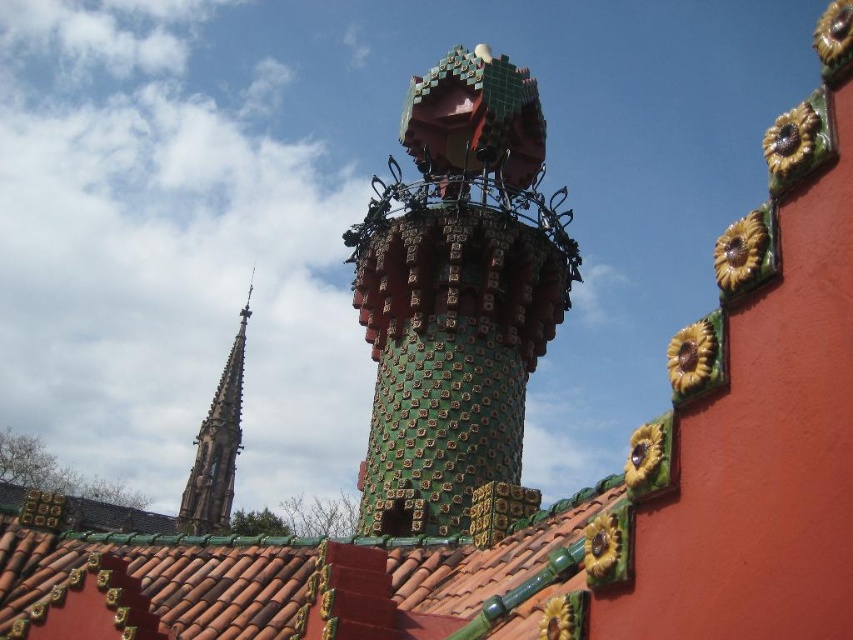
You are an architect designing a new building inspired by this style. You need to decide whether the green mosaic tower at center will fit through a doorway that is the same width as the green mosaic spire at upper left. Can it fit?

The green mosaic tower at center is wider than the green mosaic spire at upper left, so it cannot fit through the doorway designed to match the spire width.

You are an architect analyzing the roof design of this building. You notice a specific point marked at coordinate point (323, 573). What architectural element is located at this coordinate?

The architectural element located at coordinate point (323, 573) is the green glazed tiles at center.